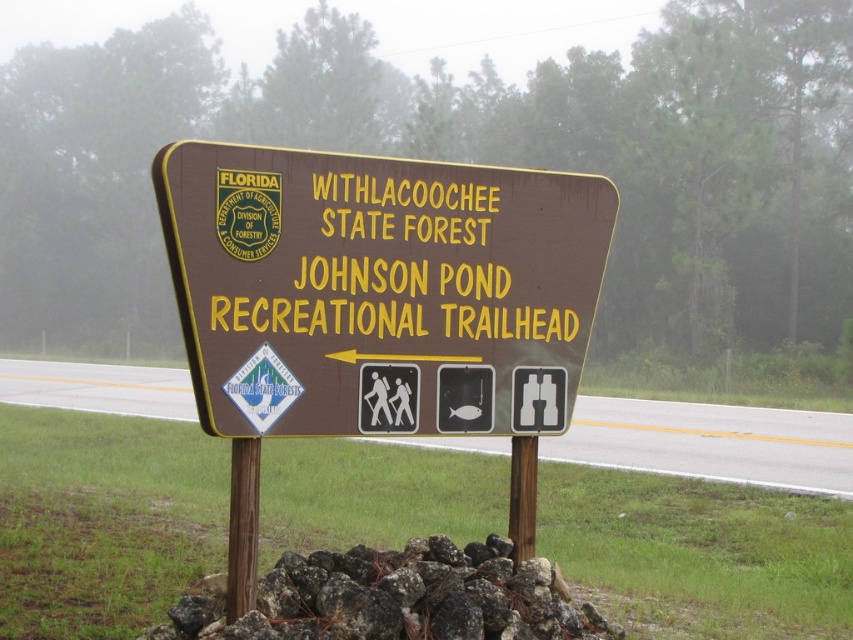
Can you confirm if brown wooden sign at center is positioned above brown wooden signpost at center?

Yes, brown wooden sign at center is above brown wooden signpost at center.

Looking at this image, who is more distant from viewer, (436, 291) or (656, 406)?

Positioned behind is point (656, 406).

What are the coordinates of `brown wooden sign at center` in the screenshot? It's located at (379, 289).

Measure the distance between brown wooden sign at center and camera.

A distance of 3.92 meters exists between brown wooden sign at center and camera.

Between brown wooden sign at center and dark gray rock at center, which one appears on the right side from the viewer's perspective?

Positioned to the right is brown wooden sign at center.

Does point (381, 211) come in front of point (314, 624)?

No.

This screenshot has width=853, height=640. What are the coordinates of `brown wooden sign at center` in the screenshot? It's located at (379, 289).

Can you confirm if brown wooden signpost at center is positioned below dark gray rock at center?

No.

Who is more forward, (715, 438) or (440, 595)?

Positioned in front is point (440, 595).

This screenshot has height=640, width=853. Identify the location of brown wooden signpost at center. (711, 442).